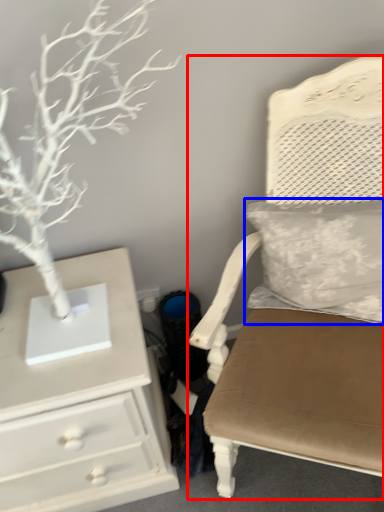
Question: Which object appears closest to the camera in this image, chair (highlighted by a red box) or pillow (highlighted by a blue box)?

Choices:
 (A) chair
 (B) pillow

Answer: (A)